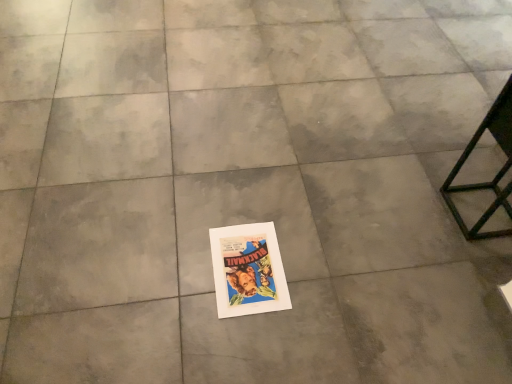
Where is `vacant region under metallic black table at right (from a real-world perspective)`? The width and height of the screenshot is (512, 384). vacant region under metallic black table at right (from a real-world perspective) is located at coordinates tap(478, 215).